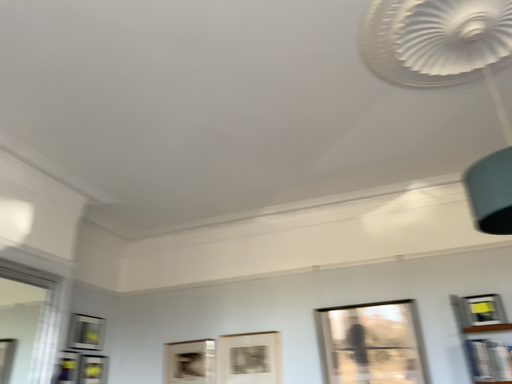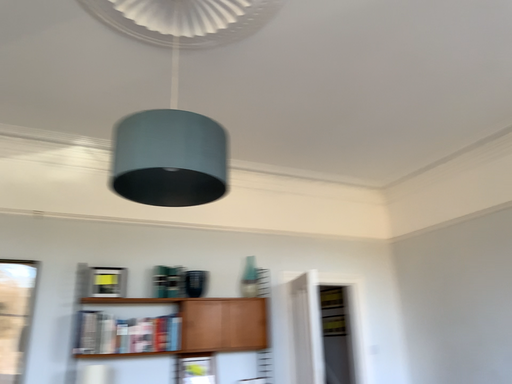
Question: How did the camera likely rotate when shooting the video?

Choices:
 (A) rotated left
 (B) rotated right

Answer: (B)